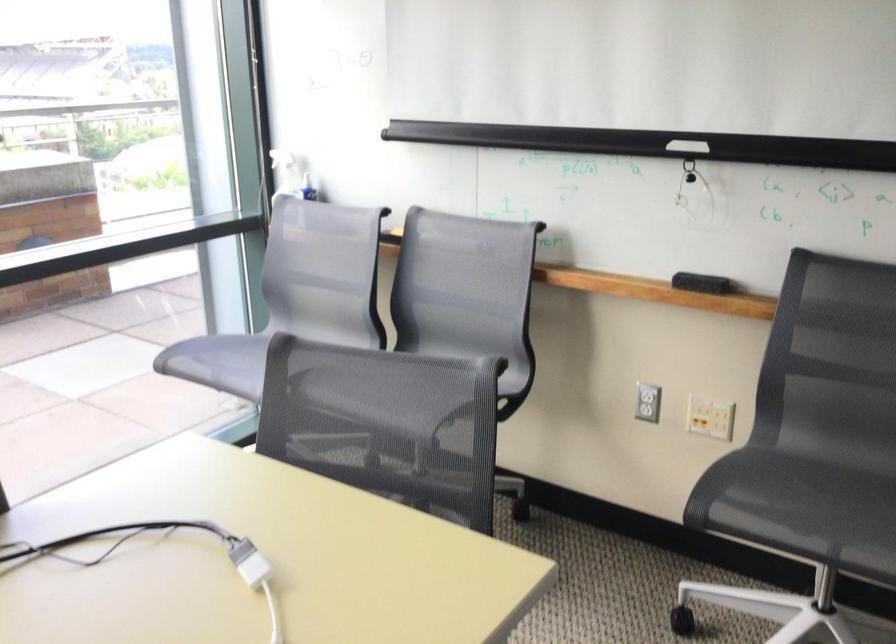
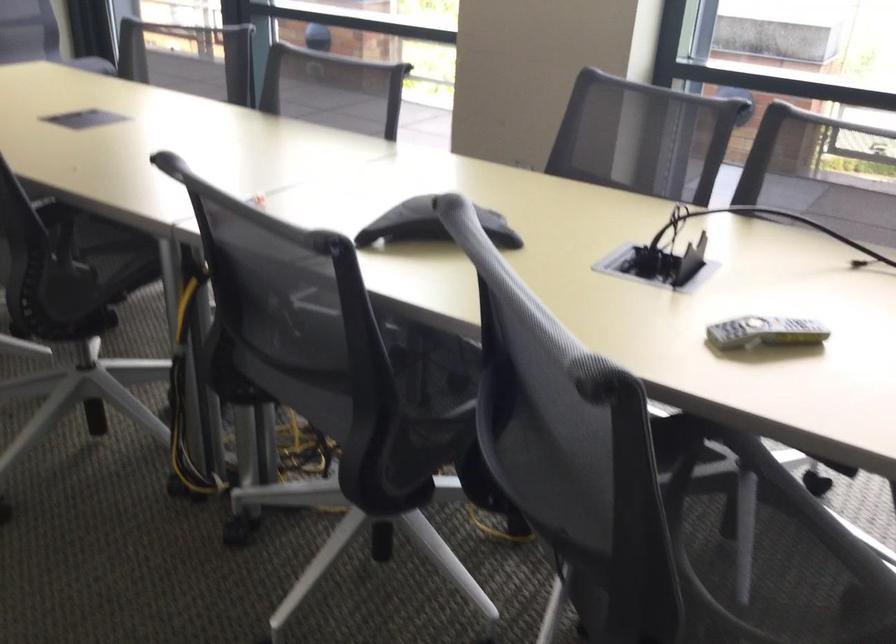
How did the camera likely rotate?

The camera rotated toward left-down.